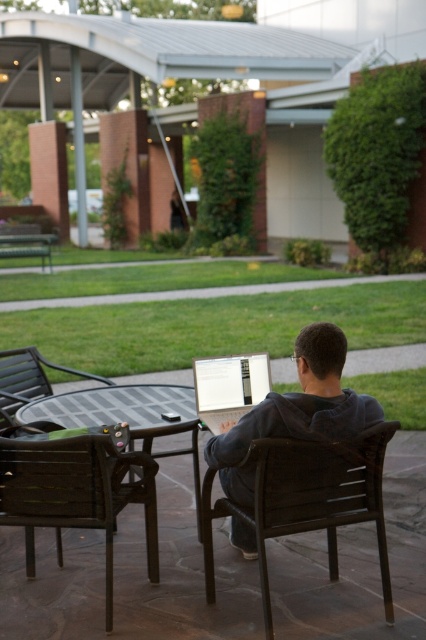
Can you confirm if silver metallic laptop at center is thinner than dark brown plastic chair at center?

Indeed, silver metallic laptop at center has a lesser width compared to dark brown plastic chair at center.

Who is positioned more to the left, silver metallic laptop at center or dark brown plastic chair at center?

dark brown plastic chair at center

Who is more forward, (245, 394) or (5, 388)?

Point (245, 394) is more forward.

The height and width of the screenshot is (640, 426). I want to click on silver metallic laptop at center, so click(x=230, y=387).

The width and height of the screenshot is (426, 640). Describe the element at coordinates (77, 490) in the screenshot. I see `brown wooden chair at lower left` at that location.

Between brown wooden chair at lower left and dark brown plastic chair at center, which one appears on the right side from the viewer's perspective?

brown wooden chair at lower left

The height and width of the screenshot is (640, 426). Find the location of `brown wooden chair at lower left`. brown wooden chair at lower left is located at coordinates (77, 490).

At what (x,y) coordinates should I click in order to perform the action: click on brown wooden chair at lower left. Please return your answer as a coordinate pair (x, y). Looking at the image, I should click on tap(77, 490).

Describe the element at coordinates (296, 410) in the screenshot. I see `dark gray hoodie at center` at that location.

Where is `dark gray hoodie at center`? dark gray hoodie at center is located at coordinates (296, 410).